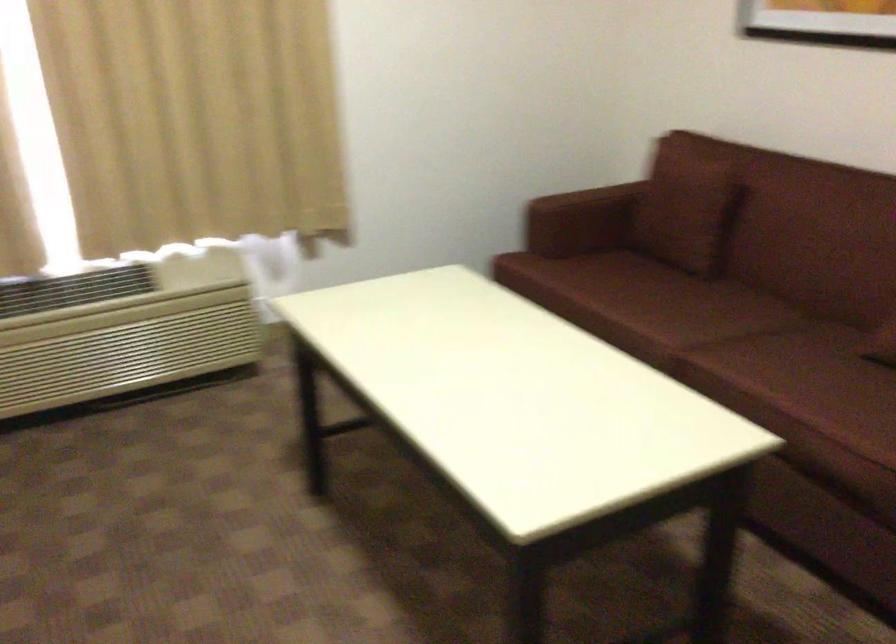
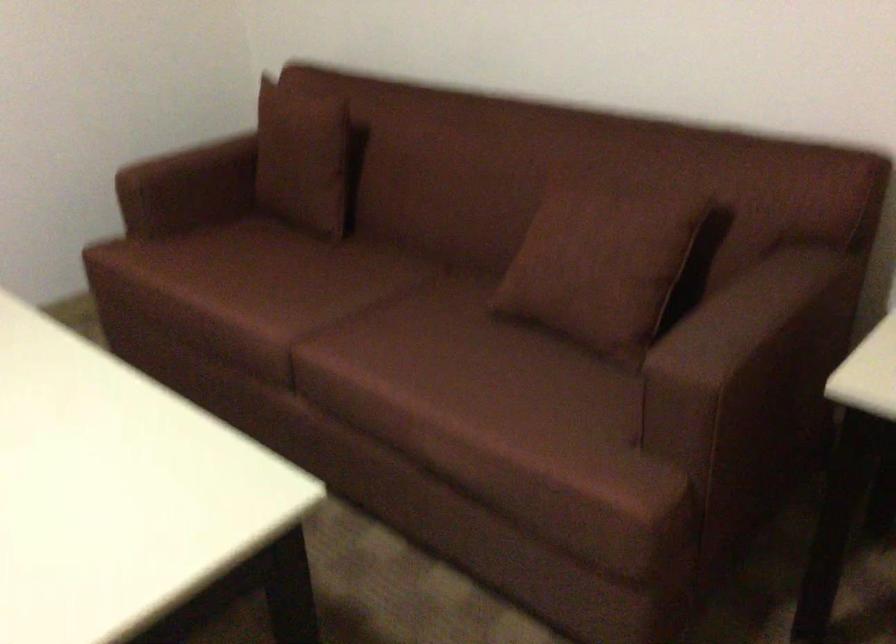
The point at (657, 299) is marked in the first image. Where is the corresponding point in the second image?

(286, 283)